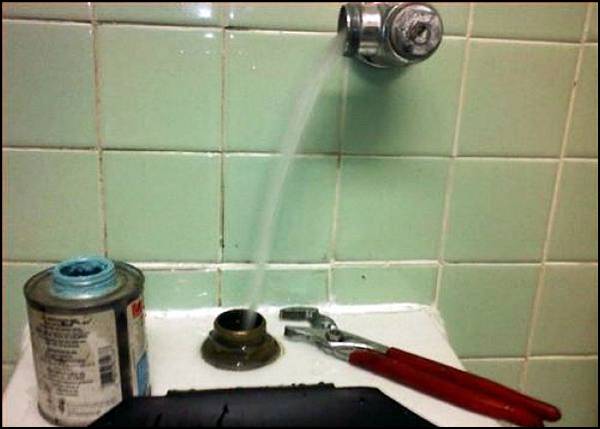
Locate an element on the screen. This screenshot has height=429, width=600. grout is located at coordinates (550, 214), (572, 260), (550, 357), (394, 262).